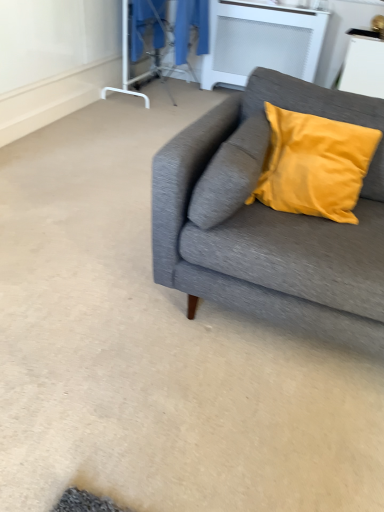
At what (x,y) coordinates should I click in order to perform the action: click on vacant region to the left of textured gray couch at right. Please return your answer as a coordinate pair (x, y). The width and height of the screenshot is (384, 512). Looking at the image, I should click on (82, 268).